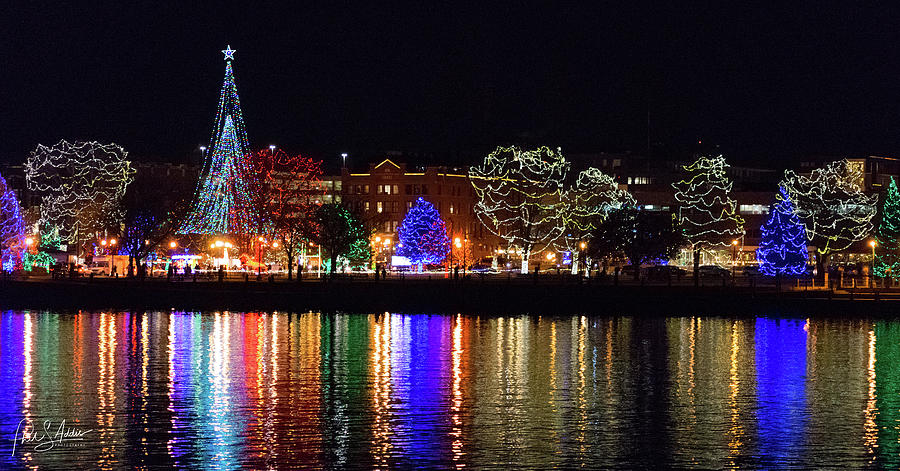
Where is `blue lights`? blue lights is located at coordinates (778, 247), (421, 226), (136, 242).